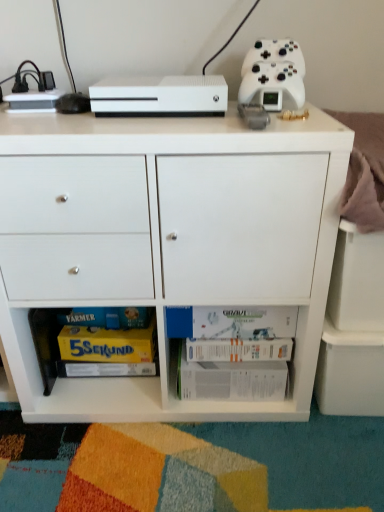
Question: In the image, is white matte controller at upper right on the left side or the right side of white matte xbox one s at upper center?

Choices:
 (A) right
 (B) left

Answer: (A)

Question: Considering the positions of point (279, 68) and point (175, 101), is point (279, 68) closer or farther from the camera than point (175, 101)?

Choices:
 (A) closer
 (B) farther

Answer: (B)

Question: Based on their relative distances, which object is nearer to the white paper book at lower center, the 2th book in the top-to-bottom sequence?

Choices:
 (A) white matte controller at upper right
 (B) white matte cabinet at center
 (C) yellow cardboard magazine at lower left
 (D) white matte xbox one s at upper center
 (E) white matte board game at lower center, the 1th book from the top

Answer: (E)

Question: Which is farther from the white matte controller at upper right?

Choices:
 (A) white paper book at lower center, which appears as the first book when ordered from the bottom
 (B) white matte board game at lower center, placed as the 2th book when sorted from bottom to top
 (C) white matte cabinet at center
 (D) white matte xbox one s at upper center
 (E) yellow cardboard magazine at lower left

Answer: (E)